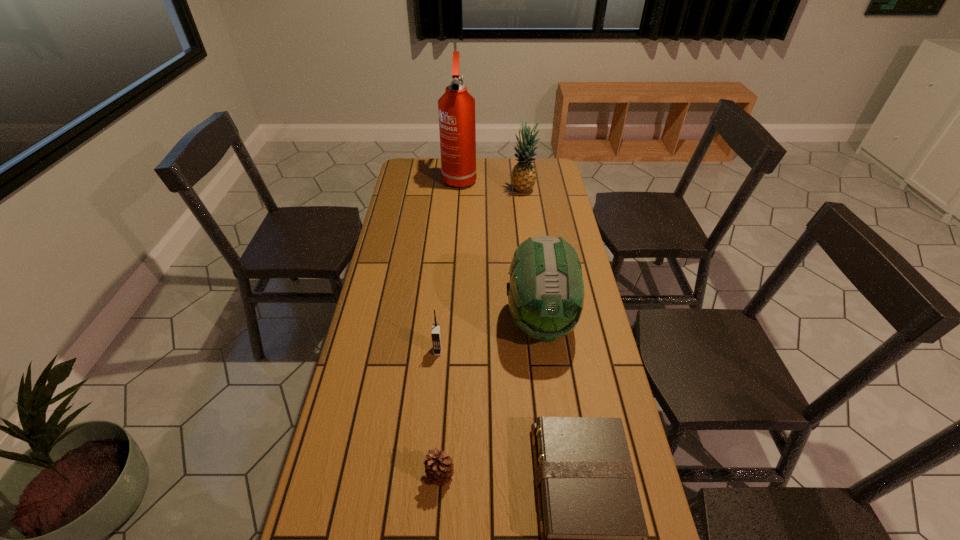
Image resolution: width=960 pixels, height=540 pixels. Find the location of `fire extinguisher`. fire extinguisher is located at coordinates (456, 107).

You are a GUI agent. You are given a task and a screenshot of the screen. Output one action in this format:
    pyautogui.click(x=<x>, y=<y>)
    Task: Click on the pineapple
    
    Given the screenshot: What is the action you would take?
    pyautogui.click(x=523, y=177)

Identify the location of football helmet. (546, 290).

At what (x,y) coordinates should I click in order to perform the action: click on cellular telephone. Please return your answer as a coordinate pair (x, y). Image resolution: width=960 pixels, height=540 pixels. Looking at the image, I should click on (436, 338).

Where is `the second shortest object`? The width and height of the screenshot is (960, 540). the second shortest object is located at coordinates (439, 468).

This screenshot has height=540, width=960. I want to click on vacant space located at the nozzle of the fire extinguisher, so click(457, 218).

You are a GUI agent. You are given a task and a screenshot of the screen. Output one action in this format:
    pyautogui.click(x=<x>, y=<y>)
    Task: Click on the blank space located on the left of the pineapple
    The height and width of the screenshot is (540, 960).
    Given the screenshot: What is the action you would take?
    [482, 190]

Identify the location of free space located on the visor of the football helmet. The width and height of the screenshot is (960, 540). (556, 434).

At what (x,y) coordinates should I click in order to perform the action: click on free location located 0.220m on the front-facing side of the fourth tallest object. Please return your answer as a coordinate pair (x, y). This screenshot has width=960, height=540. Looking at the image, I should click on (431, 424).

Where is `free region located 0.080m on the left of the pinecone`? free region located 0.080m on the left of the pinecone is located at coordinates (392, 475).